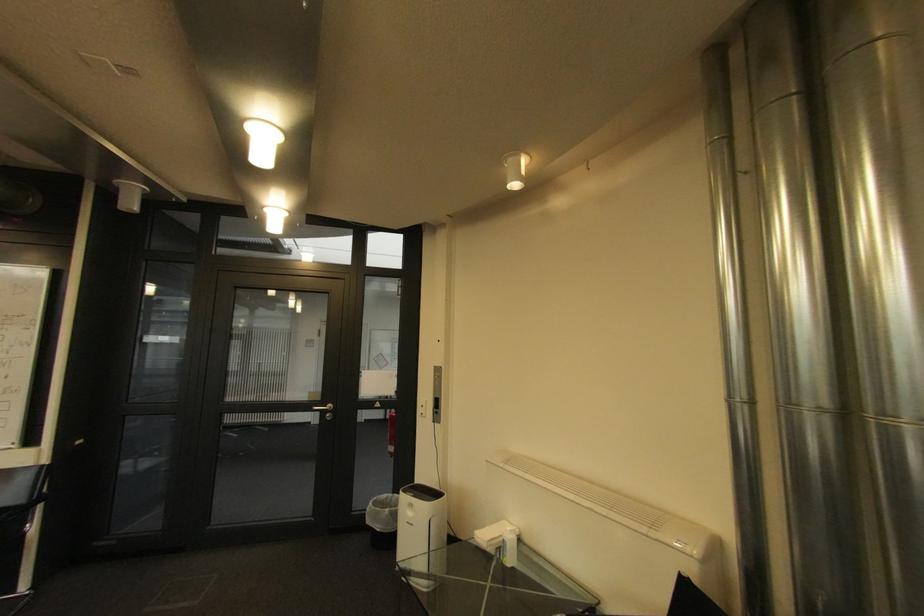
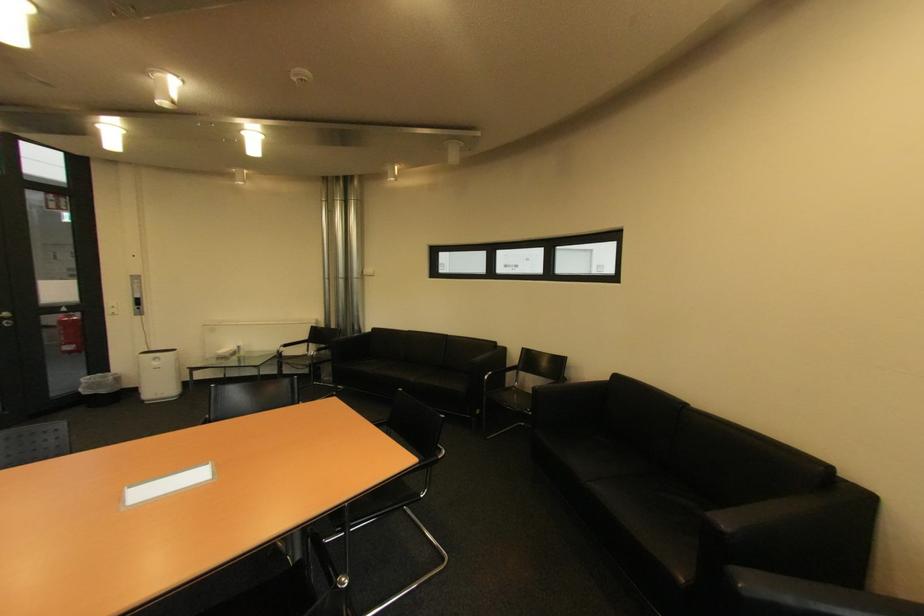
Where in the second image is the point corresponding to the point at 418,515 from the first image?

(164, 363)